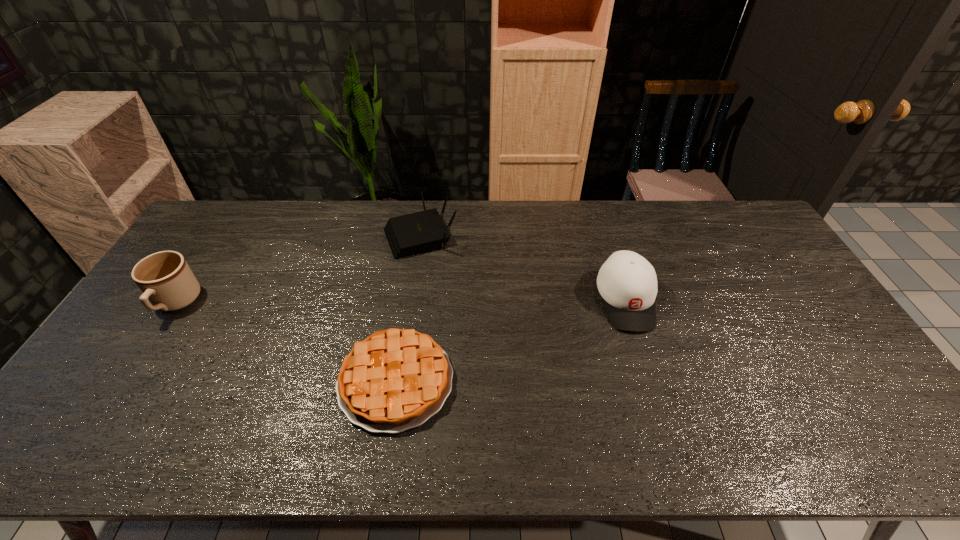
Image resolution: width=960 pixels, height=540 pixels. What are the coordinates of `empty space that is in between the mug and the rightmost object` in the screenshot? It's located at (400, 302).

Where is `vacant area between the pie and the farthest object`? The width and height of the screenshot is (960, 540). vacant area between the pie and the farthest object is located at coordinates (408, 308).

This screenshot has height=540, width=960. In order to click on unoccupied area between the mug and the rightmost object in this screenshot , I will do `click(400, 302)`.

What are the coordinates of `empty space that is in between the router and the leftmost object` in the screenshot? It's located at (298, 269).

Locate an element on the screen. vacant area between the rightmost object and the second shortest object is located at coordinates (523, 268).

The height and width of the screenshot is (540, 960). What are the coordinates of `vacant area that lies between the nearest object and the rightmost object` in the screenshot? It's located at (511, 341).

The width and height of the screenshot is (960, 540). What are the coordinates of `free space between the nearest object and the farthest object` in the screenshot? It's located at (408, 308).

Find the location of a particular element. The image size is (960, 540). free space between the nearest object and the farthest object is located at coordinates (408, 308).

Point out which object is positioned as the second nearest to the farthest object. Please provide its 2D coordinates. Your answer should be formatted as a tuple, i.e. [(x, y)], where the tuple contains the x and y coordinates of a point satisfying the conditions above.

[(627, 282)]

Find the location of a particular element. the second closest object relative to the rightmost object is located at coordinates (419, 232).